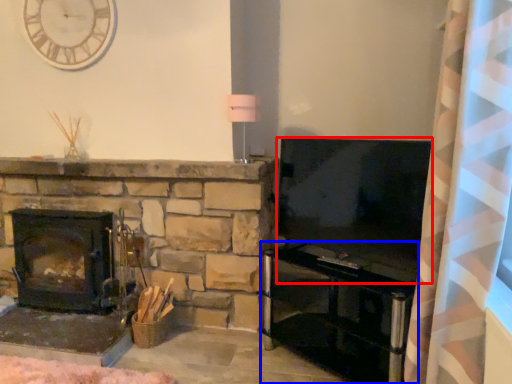
Question: Which object is further to the camera taking this photo, television (highlighted by a red box) or entertainment center (highlighted by a blue box)?

Choices:
 (A) television
 (B) entertainment center

Answer: (A)